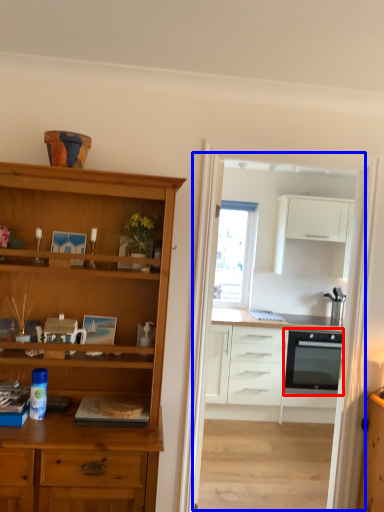
Question: Among these objects, which one is farthest to the camera, oven (highlighted by a red box) or entertainment center (highlighted by a blue box)?

Choices:
 (A) oven
 (B) entertainment center

Answer: (A)